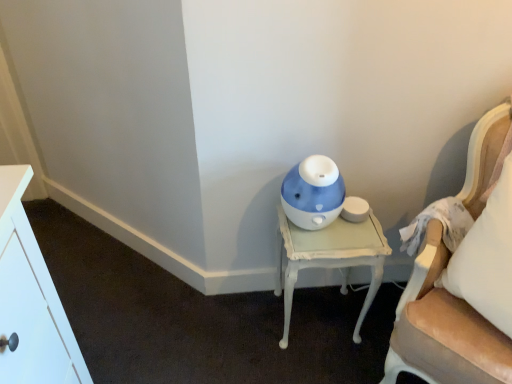
At what (x,y) coordinates should I click in order to perform the action: click on vacant space to the left of white painted wood nightstand at lower right. Please return your answer as a coordinate pair (x, y). This screenshot has height=384, width=512. Looking at the image, I should click on (x=236, y=328).